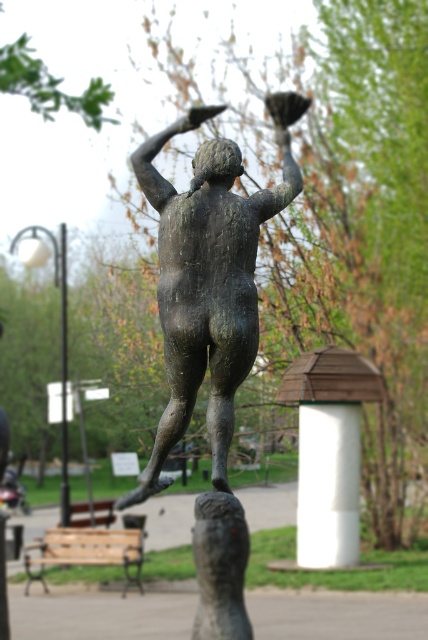
You are an art conservator assessing the placement of the bronze statue at center and the white smooth pillar at center in the image. Based on their positions, which one is closer to the viewer?

The bronze statue at center is closer to the viewer than the white smooth pillar at center because it is in front of it.

What are the coordinates of the bronze statue at center in the image?

The bronze statue at center is located at coordinates (208, 280).

You are a visitor standing in front of the bronze statue at center and the white painted wood at center. Which object is positioned higher in the scene?

The bronze statue at center is positioned higher than the white painted wood at center.